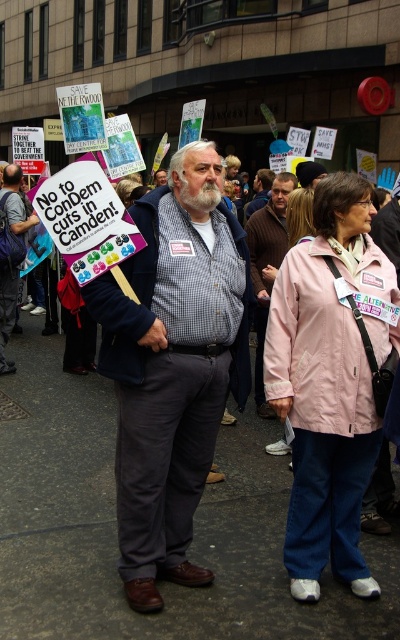
Who is higher up, pink fabric jacket at center or brown wool sweater at center?

brown wool sweater at center

The width and height of the screenshot is (400, 640). Identify the location of pink fabric jacket at center. (331, 380).

You are a GUI agent. You are given a task and a screenshot of the screen. Output one action in this format:
    pyautogui.click(x=<x>, y=<y>)
    Task: Click on the pink fabric jacket at center
    The height and width of the screenshot is (640, 400).
    Given the screenshot: What is the action you would take?
    pyautogui.click(x=331, y=380)

The image size is (400, 640). Identify the location of pink fabric jacket at center. (331, 380).

Does point (111, 314) come closer to viewer compared to point (302, 266)?

Yes, it is in front of point (302, 266).

Between checkered fabric shirt at center and pink fabric jacket at center, which one is positioned higher?

checkered fabric shirt at center is above.

What do you see at coordinates (172, 365) in the screenshot? I see `checkered fabric shirt at center` at bounding box center [172, 365].

The image size is (400, 640). Find the location of `checkered fabric shirt at center`. checkered fabric shirt at center is located at coordinates (172, 365).

Consider the image. Can you confirm if checkered fabric shirt at center is positioned above matte black jacket at center?

Actually, checkered fabric shirt at center is below matte black jacket at center.

The width and height of the screenshot is (400, 640). Describe the element at coordinates (172, 365) in the screenshot. I see `checkered fabric shirt at center` at that location.

Who is more forward, (231, 333) or (6, 280)?

Point (231, 333) is more forward.

Where is `checkered fabric shirt at center`? The height and width of the screenshot is (640, 400). checkered fabric shirt at center is located at coordinates (172, 365).